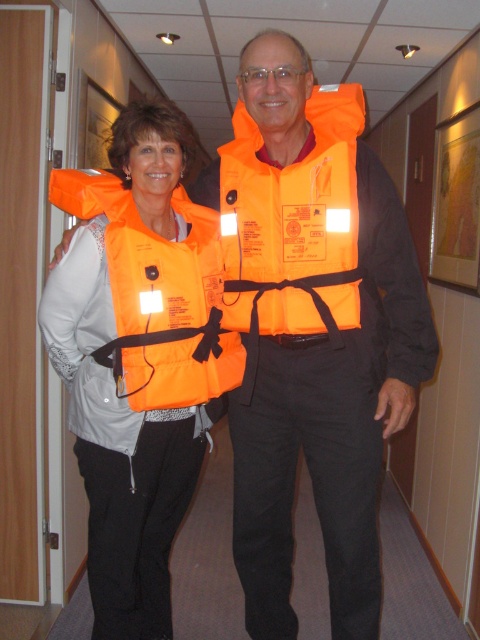
Measure the distance from orange matte life vest at left to orange fabric life jacket at center.

They are 11.44 inches apart.

Can you confirm if orange matte life vest at left is wider than orange fabric life jacket at center?

Correct, the width of orange matte life vest at left exceeds that of orange fabric life jacket at center.

Measure the distance between point (72,321) and camera.

Point (72,321) is 1.66 meters from camera.

Locate an element on the screen. This screenshot has height=640, width=480. orange matte life vest at left is located at coordinates (137, 356).

What do you see at coordinates (294, 224) in the screenshot?
I see `orange fabric life jacket at center` at bounding box center [294, 224].

From the picture: Is orange fabric life jacket at center above orange fabric life jacket at left?

Indeed, orange fabric life jacket at center is positioned over orange fabric life jacket at left.

Between point (253, 157) and point (108, 362), which one is positioned in front?

Point (253, 157)

Where is `orange fabric life jacket at center`? The image size is (480, 640). orange fabric life jacket at center is located at coordinates (294, 224).

Is point (74, 364) less distant than point (155, 296)?

No, (74, 364) is further to viewer.

Which is behind, point (43, 332) or point (164, 304)?

Positioned behind is point (43, 332).

This screenshot has height=640, width=480. I want to click on orange matte life vest at left, so click(x=137, y=356).